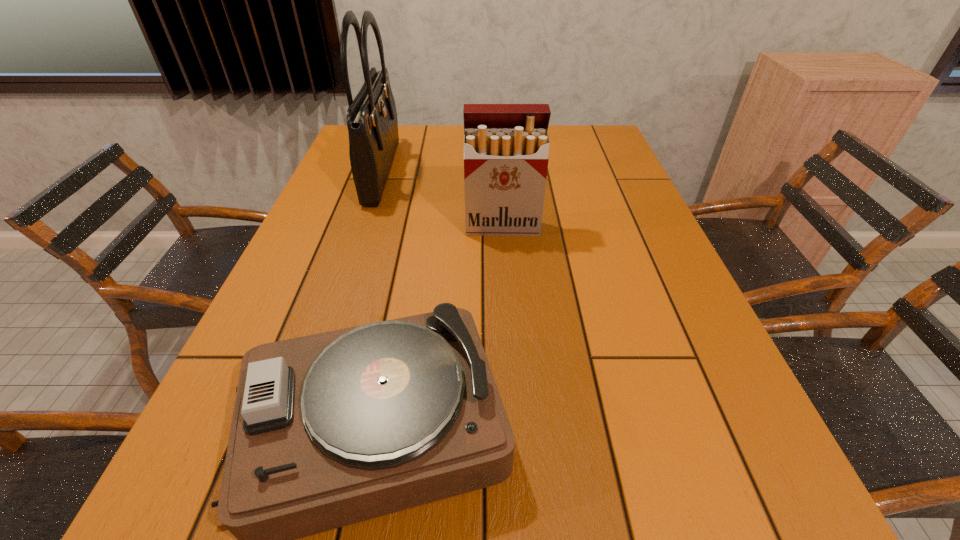
This screenshot has height=540, width=960. In the image, there is a desktop. What are the coordinates of `vacant region at the near edge` in the screenshot? It's located at (625, 535).

Identify the location of vacant space at the left edge of the desktop. The image size is (960, 540). (315, 215).

In order to click on free space at the right edge of the desktop in this screenshot , I will do `click(602, 163)`.

The image size is (960, 540). I want to click on free space between the handbag and the second shortest object, so click(x=443, y=199).

Identify the location of unoccupied position between the second tallest object and the handbag. (x=443, y=199).

What are the coordinates of `free space between the second nearest object and the farthest object` in the screenshot? It's located at (443, 199).

The width and height of the screenshot is (960, 540). What are the coordinates of `vacant area that lies between the cigarette case and the handbag` in the screenshot? It's located at (443, 199).

Identify which object is located as the nearest to the handbag. Please provide its 2D coordinates. Your answer should be formatted as a tuple, i.e. [(x, y)], where the tuple contains the x and y coordinates of a point satisfying the conditions above.

[(506, 146)]

Locate which object is the closest to the shortest object. Please provide its 2D coordinates. Your answer should be formatted as a tuple, i.e. [(x, y)], where the tuple contains the x and y coordinates of a point satisfying the conditions above.

[(506, 146)]